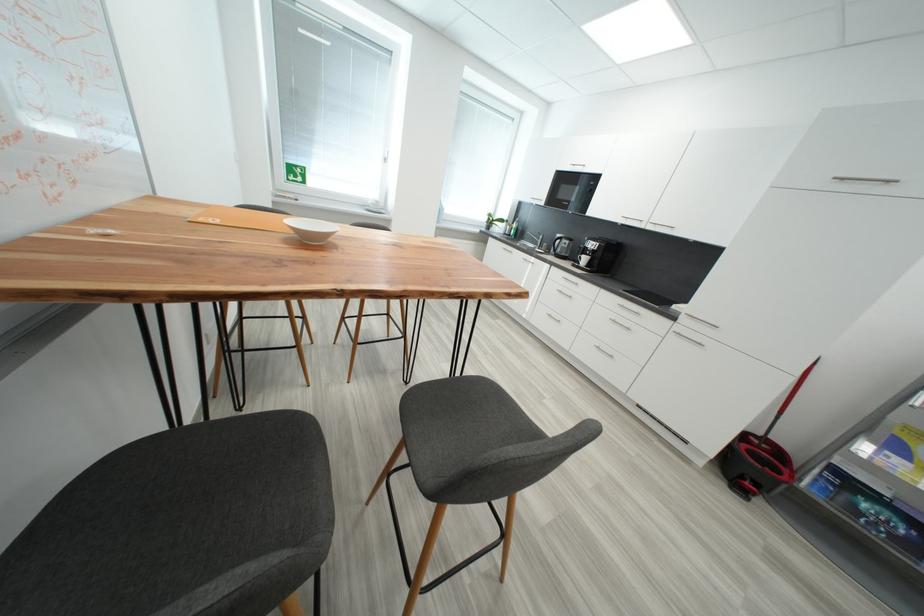
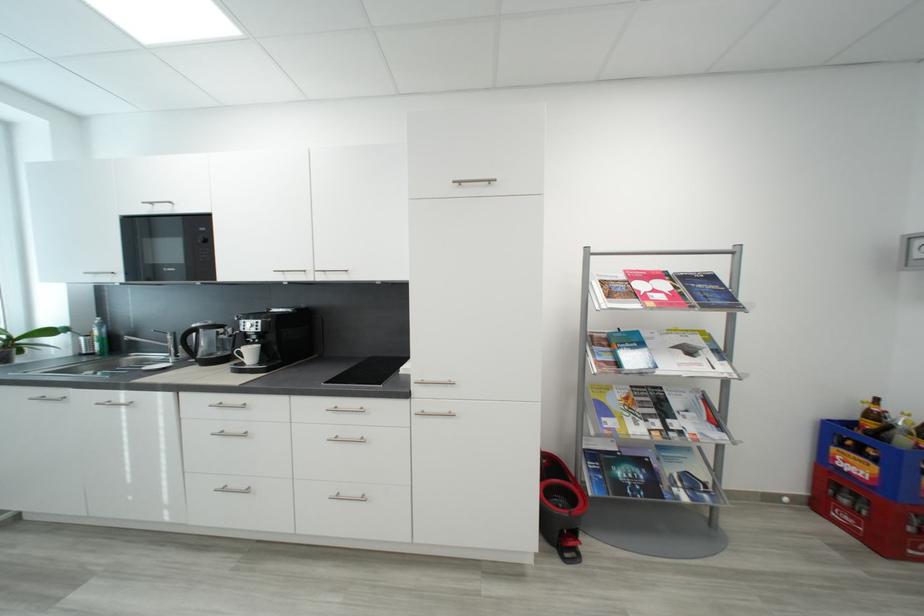
Find the pixel in the second image that matches (530,244) in the first image.

(142, 358)